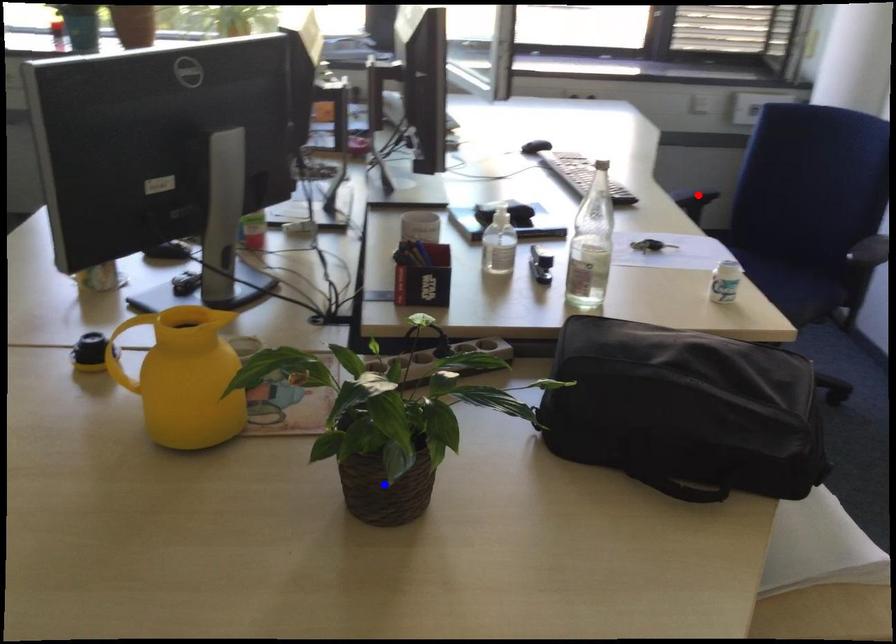
Question: Which of the two points in the image is closer to the camera?

Choices:
 (A) Blue point is closer.
 (B) Red point is closer.

Answer: (A)